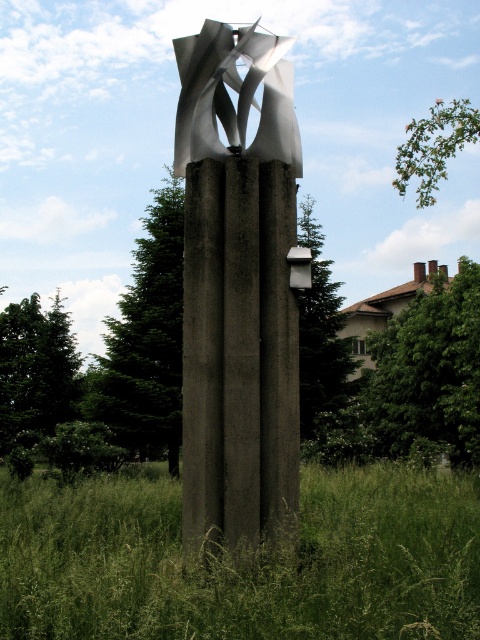
Is green grass at lower center above polished silver sculpture at center?

No.

Is green grass at lower center wider than polished silver sculpture at center?

Correct, the width of green grass at lower center exceeds that of polished silver sculpture at center.

Who is more distant from viewer, (x=140, y=577) or (x=226, y=372)?

The point (x=226, y=372) is more distant.

Image resolution: width=480 pixels, height=640 pixels. I want to click on green grass at lower center, so click(x=242, y=561).

What do you see at coordinates (242, 561) in the screenshot? The width and height of the screenshot is (480, 640). I see `green grass at lower center` at bounding box center [242, 561].

Is green grass at lower center behind metallic silver sculpture at center?

No, green grass at lower center is closer to the viewer.

Where is `green grass at lower center`? This screenshot has width=480, height=640. green grass at lower center is located at coordinates (242, 561).

Between polished silver sculpture at center and metallic silver sculpture at center, which one has less height?

polished silver sculpture at center is shorter.

Between point (216, 100) and point (261, 131), which one is positioned behind?

Positioned behind is point (216, 100).

This screenshot has height=640, width=480. Identify the location of polished silver sculpture at center. (238, 285).